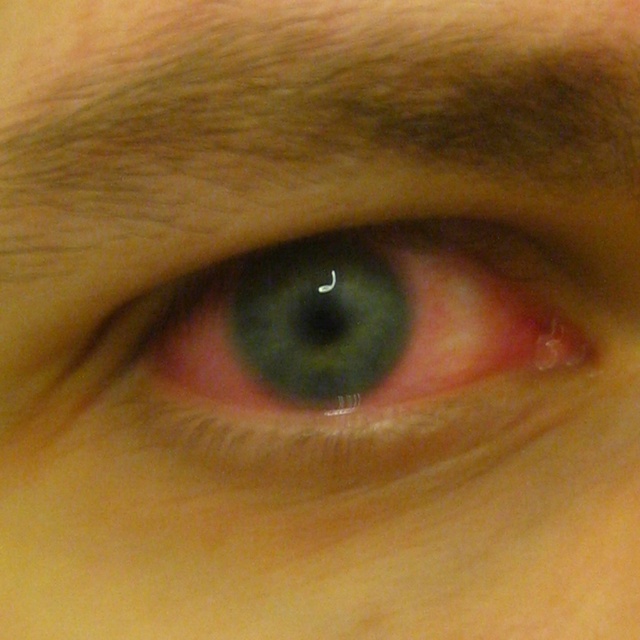
You are a makeup artist preparing to apply eyeliner. You have a pencil that is 1 cm wide. The space between the brown fuzzy eyebrow at upper center and the green matte eye at center must be at least 0.5 cm to avoid irritation. Can you safely use the pencil without causing discomfort?

The brown fuzzy eyebrow at upper center is wider than the green matte eye at center. However, the exact distance between them isn

You are a dermatologist examining a patient. You notice the brown fuzzy eyebrow at upper center and the green matte eye at center. Based on their positions, which object is located to the left of the other?

The brown fuzzy eyebrow at upper center is to the left of the green matte eye at center, so the eyebrow is positioned to the left of the eye.

You are a photographer adjusting the focus on your camera. You want to ensure that both the point at coordinates point (243, 188) and point (342, 298) are in focus. Given that your current focus plane can only accommodate one focal distance, which point should you prioritize focusing on to ensure at least one is sharp?

You should prioritize focusing on point (243, 188) because it is closer to the camera than point (342, 298). Since the focus plane can only accommodate one focal distance, focusing on the closer point increases the likelihood that it will be sharp, while the farther point may be slightly out of focus.